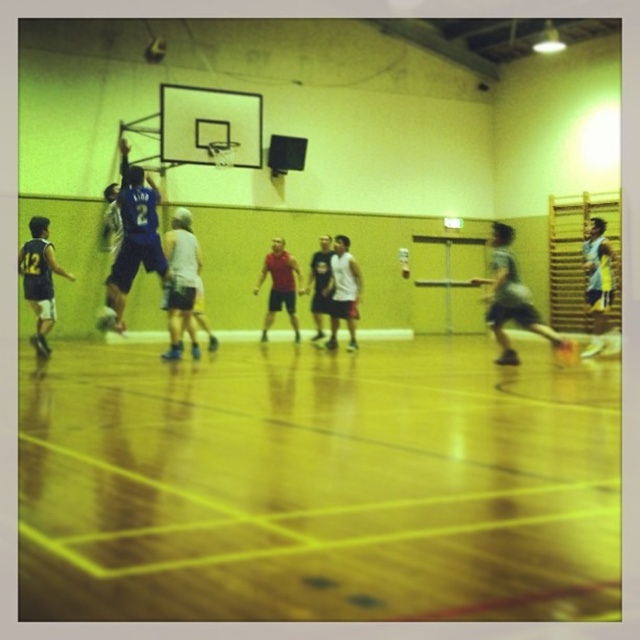
Question: Which is farther from the white matte basketball player at center?

Choices:
 (A) yellow polished wood basketball court at center
 (B) yellow jersey at right
 (C) blue jersey at center

Answer: (A)

Question: Does red matte shirt at center have a lesser width compared to shiny metallic basketball at center?

Choices:
 (A) yes
 (B) no

Answer: (B)

Question: Considering the relative positions of yellow polished wood basketball court at center and blue jersey at center in the image provided, where is yellow polished wood basketball court at center located with respect to blue jersey at center?

Choices:
 (A) above
 (B) below

Answer: (B)

Question: Which object is the farthest from the dark blue jersey at left?

Choices:
 (A) blue jersey at center
 (B) gray athletic shorts at center
 (C) yellow jersey at right
 (D) yellow polished wood basketball court at center

Answer: (C)

Question: Is blue jersey at center in front of yellow jersey at right?

Choices:
 (A) yes
 (B) no

Answer: (A)

Question: Based on their relative distances, which object is farther from the white matte basketball player at center?

Choices:
 (A) yellow jersey at right
 (B) blue jersey at center
 (C) red matte shirt at center

Answer: (A)